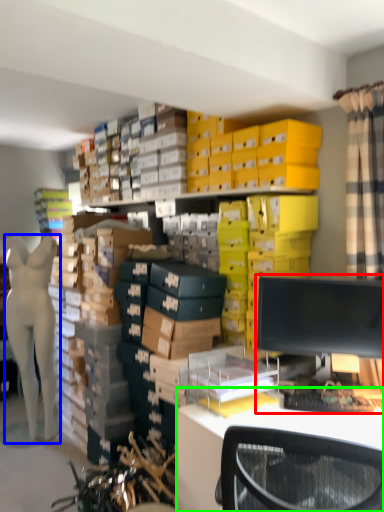
Question: Which object is the closest to the desktop computer (highlighted by a red box)? Choose among these: person (highlighted by a blue box) or desk (highlighted by a green box).

Choices:
 (A) person
 (B) desk

Answer: (B)